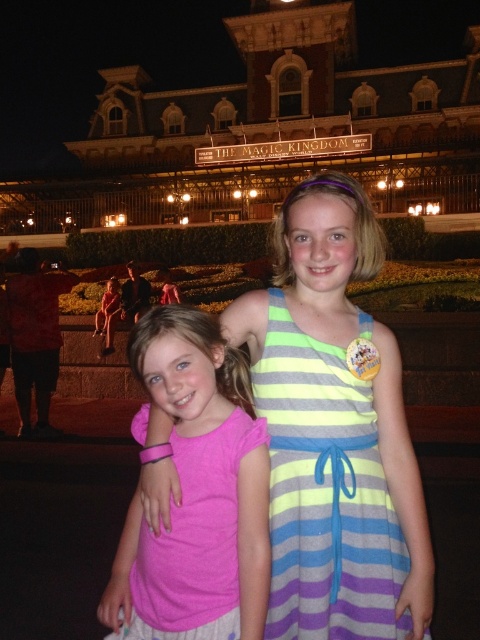
You are a photographer taking a picture of the two points in the image. Which point, point (411, 545) or point (203, 358), is closer to you?

Point (411, 545) is closer to the viewer than point (203, 358).

You are a photographer at Disney World and need to adjust the lighting for a photo shoot. You notice two pink garments in the scene. Which one is positioned higher up between the pink fabric dress at center and the pink fabric shirt at center?

The pink fabric dress at center is above the pink fabric shirt at center, so the dress is positioned higher up.

You are a photographer standing in front of The Magic Kingdom sign at night. You want to take a photo of both the pink fabric dress at center and the pink fabric shirt at center in the same frame. Given that your camera has a 50mm lens, which has a field of view that can capture objects up to 10 feet apart, will you be able to include both items in the photo?

The pink fabric dress at center and pink fabric shirt at center are 11.04 feet apart, which exceeds the camera lens field of view limit of 10 feet. Therefore, you cannot capture both items in the same frame.